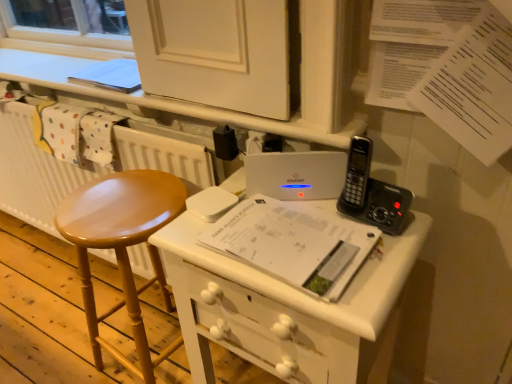
This screenshot has height=384, width=512. Identify the location of white paper at center. (294, 244).

Describe the element at coordinates (289, 309) in the screenshot. This screenshot has width=512, height=384. I see `white painted wood desk at center` at that location.

This screenshot has height=384, width=512. What do you see at coordinates (122, 247) in the screenshot?
I see `shiny wood stool at left` at bounding box center [122, 247].

This screenshot has height=384, width=512. In order to click on white paper at center in this screenshot , I will do tap(294, 244).

Is white painted wood desk at center located within white plastic router at center?

No, white plastic router at center does not contain white painted wood desk at center.

Does point (323, 167) come in front of point (281, 315)?

No, (323, 167) is behind (281, 315).

From a real-world perspective, is white plastic router at center positioned above or below white painted wood desk at center?

white plastic router at center is situated higher than white painted wood desk at center in the real world.

Is white plastic router at center further to the viewer compared to white painted wood desk at center?

Yes, white plastic router at center is further from the camera.

Considering the points (292, 221) and (83, 260), which point is behind, point (292, 221) or point (83, 260)?

The point (83, 260) is farther.

Are white paper at center and shiny wood stool at left making contact?

No, white paper at center is not in contact with shiny wood stool at left.

Which object is positioned more to the left, white paper at center or shiny wood stool at left?

Positioned to the left is shiny wood stool at left.

Is white paper at center facing towards shiny wood stool at left?

No, white paper at center is not turned towards shiny wood stool at left.

Who is bigger, white matte radiator at left or shiny wood stool at left?

white matte radiator at left.

Is white matte radiator at left touching shiny wood stool at left?

No, white matte radiator at left is not with shiny wood stool at left.

Which of these two, white matte radiator at left or shiny wood stool at left, stands taller?

white matte radiator at left is taller.

In the scene shown: From the image's perspective, is white painted wood desk at center beneath white matte radiator at left?

Indeed, from the image's perspective, white painted wood desk at center is shown beneath white matte radiator at left.

How much distance is there between white painted wood desk at center and white matte radiator at left?

The distance of white painted wood desk at center from white matte radiator at left is 24.90 inches.

Where is `radiator above the white painted wood desk at center (from a real-world perspective)`? radiator above the white painted wood desk at center (from a real-world perspective) is located at coordinates (33, 172).

Does point (296, 325) come behind point (23, 103)?

No, it is not.

Does white painted wood desk at center contain white paper at center?

Yes, white painted wood desk at center is surrounding white paper at center.

From the image's perspective, does white painted wood desk at center appear higher than white paper at center?

No, from the image's perspective, white painted wood desk at center is not above white paper at center.

Who is taller, white painted wood desk at center or white paper at center?

With more height is white painted wood desk at center.

Considering the positions of objects white painted wood desk at center and white paper at center in the image provided, who is in front, white painted wood desk at center or white paper at center?

white painted wood desk at center is in front.

Is shiny wood stool at left bigger or smaller than black plastic phone at upper right?

In the image, shiny wood stool at left appears to be larger than black plastic phone at upper right.

Between shiny wood stool at left and black plastic phone at upper right, which one has more height?

With more height is shiny wood stool at left.

Would you say black plastic phone at upper right is part of shiny wood stool at left's contents?

No, black plastic phone at upper right is not a part of shiny wood stool at left.

Considering the positions of points (82, 196) and (401, 222), is point (82, 196) farther from camera compared to point (401, 222)?

Yes, it is.

Considering the positions of objects white plastic router at center and white matte radiator at left in the image provided, who is more to the left, white plastic router at center or white matte radiator at left?

white matte radiator at left is more to the left.

From the image's perspective, is white plastic router at center above white matte radiator at left?

Yes, from the image's perspective, white plastic router at center is on top of white matte radiator at left.

Is white matte radiator at left located within white plastic router at center?

That's incorrect, white matte radiator at left is not inside white plastic router at center.

Based on the photo, in terms of width, does white plastic router at center look wider or thinner when compared to white matte radiator at left?

white plastic router at center is thinner than white matte radiator at left.

The width and height of the screenshot is (512, 384). In the image, there is a white painted wood desk at center. In order to click on laptop above it (from the image's perspective) in this screenshot , I will do `click(296, 174)`.

Locate an element on the screen. book in front of the shiny wood stool at left is located at coordinates (294, 244).

When comparing their distances from shiny wood stool at left, does white plastic router at center or white painted wood desk at center seem closer?

Among the two, white painted wood desk at center is located nearer to shiny wood stool at left.

When comparing their distances from white painted wood desk at center, does black plastic phone at upper right or white plastic router at center seem closer?

Based on the image, white plastic router at center appears to be nearer to white painted wood desk at center.

Which object lies nearer to the anchor point black plastic phone at upper right, white plastic router at center or shiny wood stool at left?

white plastic router at center is positioned closer to the anchor black plastic phone at upper right.

Estimate the real-world distances between objects in this image. Which object is closer to white plastic router at center, black plastic phone at upper right or white painted wood desk at center?

The object closer to white plastic router at center is black plastic phone at upper right.

Based on their spatial positions, is white painted wood desk at center or white matte radiator at left closer to black plastic phone at upper right?

white painted wood desk at center.

Which object lies further to the anchor point white painted wood desk at center, white paper at center or white matte radiator at left?

white matte radiator at left.

Estimate the real-world distances between objects in this image. Which object is further from white paper at center, white matte radiator at left or white painted wood desk at center?

white matte radiator at left is further to white paper at center.

Consider the image. When comparing their distances from white plastic router at center, does white matte radiator at left or shiny wood stool at left seem closer?

shiny wood stool at left lies closer to white plastic router at center than the other object.

Where is `book between shiny wood stool at left and black plastic phone at upper right from left to right`? This screenshot has width=512, height=384. book between shiny wood stool at left and black plastic phone at upper right from left to right is located at coordinates (294, 244).

Locate an element on the screen. The height and width of the screenshot is (384, 512). equipment positioned between white paper at center and white plastic router at center from near to far is located at coordinates (372, 193).

The image size is (512, 384). In order to click on book between white matte radiator at left and black plastic phone at upper right in the horizontal direction in this screenshot , I will do `click(294, 244)`.

I want to click on desk between shiny wood stool at left and black plastic phone at upper right in the horizontal direction, so click(x=289, y=309).